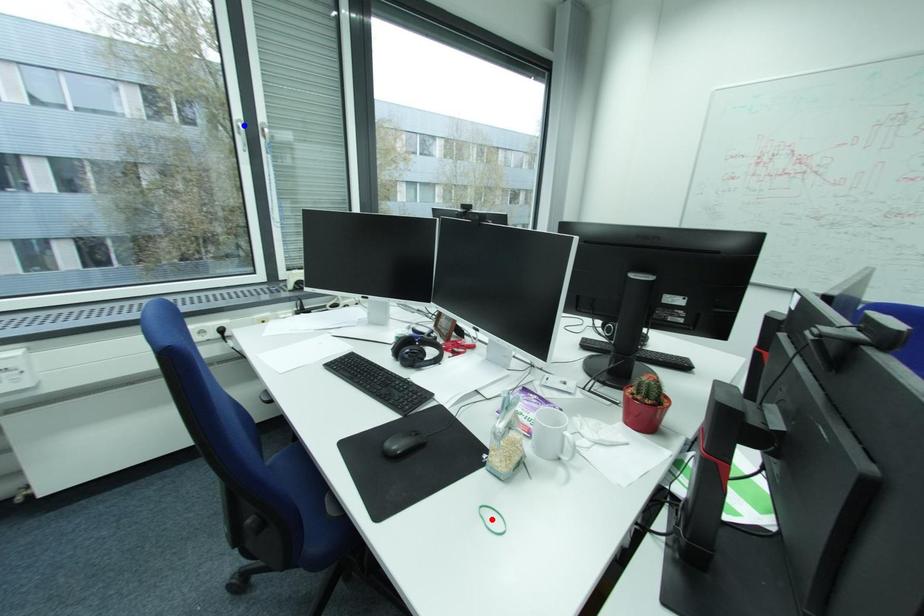
Question: In the image, two points are highlighted. Which point is nearer to the camera? Reply with the corresponding letter.

Choices:
 (A) blue point
 (B) red point

Answer: (B)